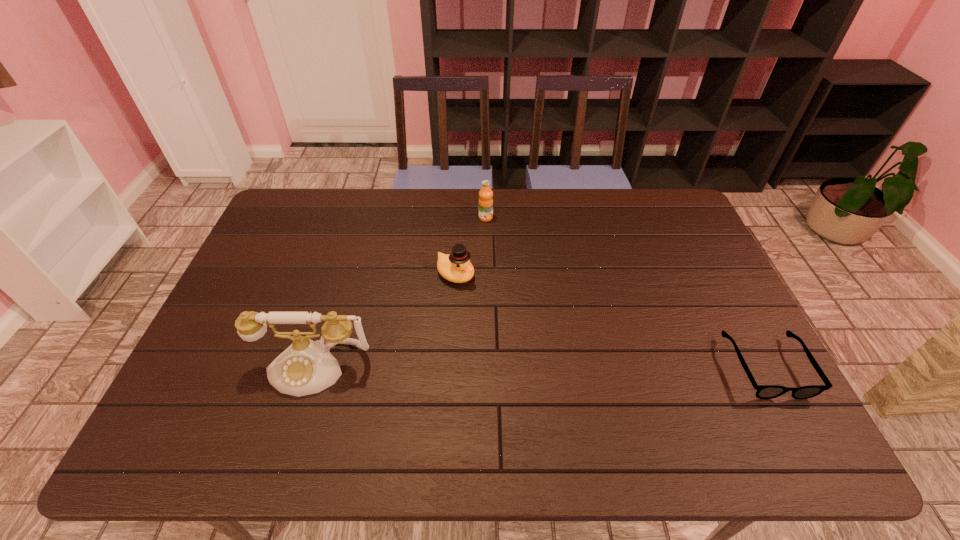
Find the location of `object at the near right corner`. object at the near right corner is located at coordinates (763, 391).

In the image, there is a desktop. Where is `free space at the far edge`? This screenshot has width=960, height=540. free space at the far edge is located at coordinates (409, 201).

In the image, there is a desktop. At what (x,y) coordinates should I click in order to perform the action: click on vacant space at the near edge. Please return your answer as a coordinate pair (x, y). This screenshot has height=540, width=960. Looking at the image, I should click on (347, 379).

Find the location of a particular element. The height and width of the screenshot is (540, 960). vacant space at the left edge is located at coordinates click(249, 302).

Where is `free location at the right edge of the desktop`? Image resolution: width=960 pixels, height=540 pixels. free location at the right edge of the desktop is located at coordinates (693, 310).

Image resolution: width=960 pixels, height=540 pixels. I want to click on vacant area at the far left corner of the desktop, so click(x=294, y=198).

In the image, there is a desktop. Where is `vacant region at the near right corner`? The image size is (960, 540). vacant region at the near right corner is located at coordinates (757, 410).

Image resolution: width=960 pixels, height=540 pixels. I want to click on free space between the shortest object and the second object from left to right, so click(x=611, y=321).

Locate an element on the screen. The width and height of the screenshot is (960, 540). vacant area that lies between the second shortest object and the farthest object is located at coordinates (470, 246).

Locate an element on the screen. vacant area between the third shortest object and the third tallest object is located at coordinates (470, 246).